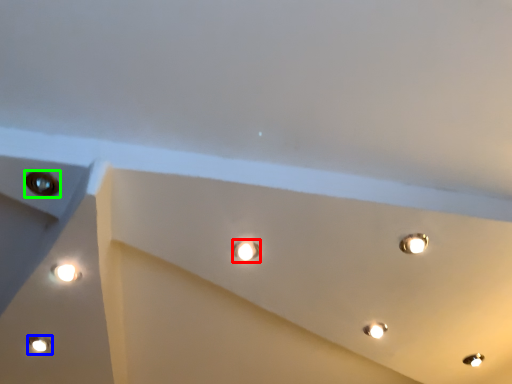
Question: Which is nearer to the droplight (highlighted by a red box)? lamp (highlighted by a blue box) or hole (highlighted by a green box).

Choices:
 (A) lamp
 (B) hole

Answer: (B)